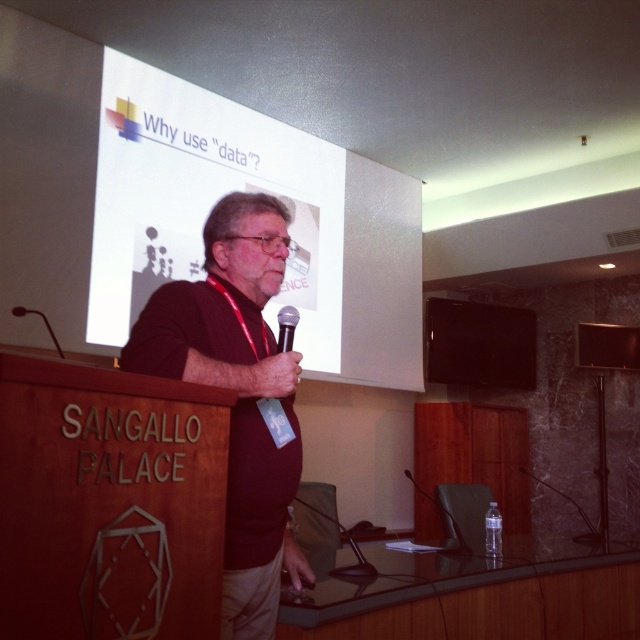
Question: Is white matte projection screen at upper center in front of dark red shirt at center?

Choices:
 (A) yes
 (B) no

Answer: (B)

Question: From the image, what is the correct spatial relationship of dark red shirt at center in relation to black matte microphone at left?

Choices:
 (A) above
 (B) below

Answer: (B)

Question: Which point is closer to the camera taking this photo?

Choices:
 (A) (401, 344)
 (B) (132, 332)
 (C) (58, 348)

Answer: (B)

Question: Estimate the real-world distances between objects in this image. Which object is farther from the black matte microphone at left?

Choices:
 (A) white matte projection screen at upper center
 (B) black matte microphone at center
 (C) dark red shirt at center

Answer: (A)

Question: Which point is closer to the camera taking this photo?

Choices:
 (A) (285, 330)
 (B) (12, 314)
 (C) (296, 204)

Answer: (A)

Question: Is white matte projection screen at upper center to the left of black matte microphone at left from the viewer's perspective?

Choices:
 (A) no
 (B) yes

Answer: (A)